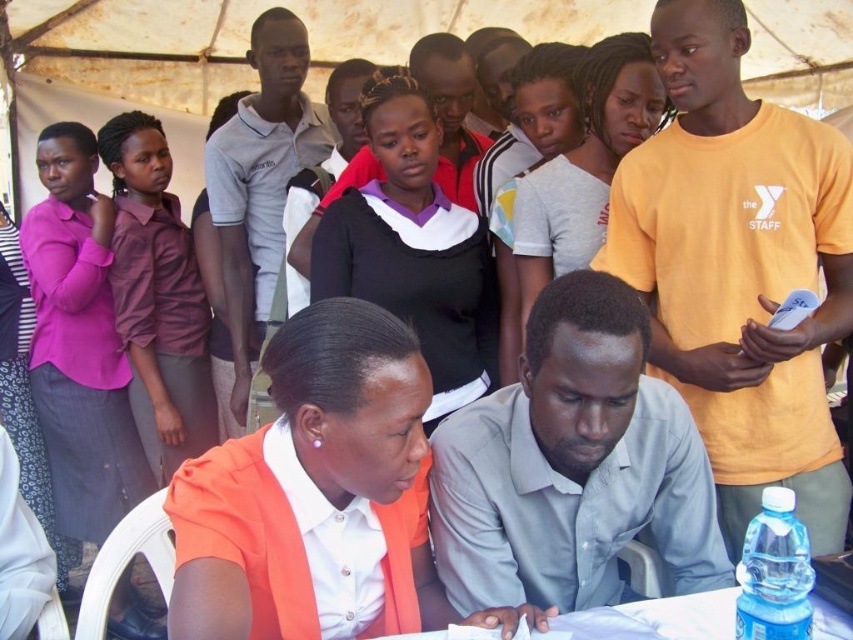
Can you confirm if purple fabric shirt at left is positioned to the left of light gray cotton shirt at upper center?

Indeed, purple fabric shirt at left is positioned on the left side of light gray cotton shirt at upper center.

Which is more to the left, purple fabric shirt at left or light gray cotton shirt at upper center?

From the viewer's perspective, purple fabric shirt at left appears more on the left side.

In order to click on purple fabric shirt at left in this screenshot , I will do `click(157, 296)`.

Is black matte shirt at center wider than matte black shirt at upper center?

Yes, black matte shirt at center is wider than matte black shirt at upper center.

Can you confirm if black matte shirt at center is smaller than matte black shirt at upper center?

Actually, black matte shirt at center might be larger than matte black shirt at upper center.

Identify the location of black matte shirt at center. The width and height of the screenshot is (853, 640). (410, 248).

Can you confirm if orange fabric shirt at lower center is positioned above matte pink blouse at left?

No, orange fabric shirt at lower center is not above matte pink blouse at left.

From the picture: Is orange fabric shirt at lower center wider than matte pink blouse at left?

Yes, orange fabric shirt at lower center is wider than matte pink blouse at left.

Is point (312, 522) positioned behind point (99, 266)?

That is False.

This screenshot has height=640, width=853. I want to click on orange fabric shirt at lower center, so 318,497.